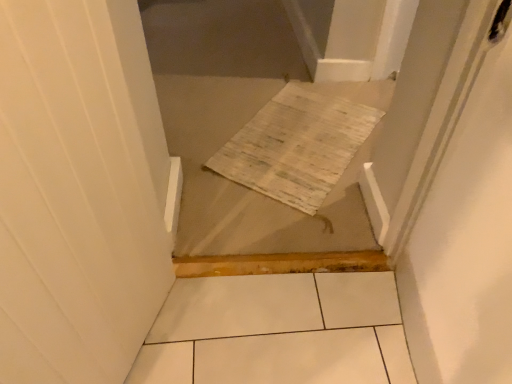
What do you see at coordinates (301, 141) in the screenshot? I see `woven fabric rug at center` at bounding box center [301, 141].

Find the location of a particular element. The image size is (512, 384). woven fabric rug at center is located at coordinates (301, 141).

The height and width of the screenshot is (384, 512). Identify the location of white glossy screen door at upper right. (448, 111).

What do you see at coordinates (448, 111) in the screenshot?
I see `white glossy screen door at upper right` at bounding box center [448, 111].

You are a GUI agent. You are given a task and a screenshot of the screen. Output one action in this format:
    pyautogui.click(x=<x>, y=<y>)
    Task: Click on the woven fabric rug at center
    
    Given the screenshot: What is the action you would take?
    pyautogui.click(x=301, y=141)

Is white glossy screen door at upper right to the left of woven fabric rug at center from the viewer's perspective?

In fact, white glossy screen door at upper right is to the right of woven fabric rug at center.

Is white glossy screen door at upper right behind woven fabric rug at center?

No, the depth of white glossy screen door at upper right is less than that of woven fabric rug at center.

Does point (389, 252) come closer to viewer compared to point (230, 175)?

Yes.

From the image's perspective, who appears lower, white glossy screen door at upper right or woven fabric rug at center?

From the image's view, woven fabric rug at center is below.

From a real-world perspective, is white glossy screen door at upper right on top of woven fabric rug at center?

Yes, from a real-world perspective, white glossy screen door at upper right is above woven fabric rug at center.

Which of these two, white glossy screen door at upper right or woven fabric rug at center, is wider?

Wider between the two is woven fabric rug at center.

Considering the relative sizes of white glossy screen door at upper right and woven fabric rug at center in the image provided, is white glossy screen door at upper right shorter than woven fabric rug at center?

Incorrect, the height of white glossy screen door at upper right does not fall short of that of woven fabric rug at center.

Can you confirm if white glossy screen door at upper right is bigger than woven fabric rug at center?

Indeed, white glossy screen door at upper right has a larger size compared to woven fabric rug at center.

Looking at this image, is white glossy screen door at upper right situated inside woven fabric rug at center or outside?

white glossy screen door at upper right exists outside the volume of woven fabric rug at center.

Is white glossy screen door at upper right positioned far away from woven fabric rug at center?

white glossy screen door at upper right is near woven fabric rug at center, not far away.

Is woven fabric rug at center at the back of white glossy screen door at upper right?

That's not correct — white glossy screen door at upper right is not looking away from woven fabric rug at center.

What's the angular difference between white glossy screen door at upper right and woven fabric rug at center's facing directions?

white glossy screen door at upper right and woven fabric rug at center are facing 38.6 degrees away from each other.

Measure the distance from white glossy screen door at upper right to woven fabric rug at center.

white glossy screen door at upper right and woven fabric rug at center are 31.52 inches apart from each other.

Image resolution: width=512 pixels, height=384 pixels. Find the location of `screen door above the woven fabric rug at center (from the image's perspective)`. screen door above the woven fabric rug at center (from the image's perspective) is located at coordinates (448, 111).

Based on their positions, is woven fabric rug at center located to the left or right of white glossy screen door at upper right?

woven fabric rug at center is positioned on white glossy screen door at upper right's left side.

In the scene shown: Is woven fabric rug at center positioned in front of white glossy screen door at upper right?

No, the depth of woven fabric rug at center is greater than that of white glossy screen door at upper right.

Does point (311, 108) come behind point (449, 74)?

Yes, it is.

From the image's perspective, is woven fabric rug at center located above or below white glossy screen door at upper right?

From the image's perspective, woven fabric rug at center appears below white glossy screen door at upper right.

From a real-world perspective, which object stands above the other?

In real-world perspective, white glossy screen door at upper right is above.

Can you confirm if woven fabric rug at center is wider than white glossy screen door at upper right?

Correct, the width of woven fabric rug at center exceeds that of white glossy screen door at upper right.

Can you confirm if woven fabric rug at center is shorter than white glossy screen door at upper right?

Yes, woven fabric rug at center is shorter than white glossy screen door at upper right.

Is woven fabric rug at center bigger than white glossy screen door at upper right?

Actually, woven fabric rug at center might be smaller than white glossy screen door at upper right.

Is woven fabric rug at center not inside white glossy screen door at upper right?

Yes.

Is woven fabric rug at center in contact with white glossy screen door at upper right?

No, woven fabric rug at center is not making contact with white glossy screen door at upper right.

Is woven fabric rug at center facing away from white glossy screen door at upper right?

No, woven fabric rug at center is not facing away from white glossy screen door at upper right.

How many degrees apart are the facing directions of woven fabric rug at center and white glossy screen door at upper right?

There is a 38.6-degree angle between the facing directions of woven fabric rug at center and white glossy screen door at upper right.

The width and height of the screenshot is (512, 384). What are the coordinates of `screen door on the right of woven fabric rug at center` in the screenshot? It's located at (448, 111).

The width and height of the screenshot is (512, 384). I want to click on cardboard on the left of white glossy screen door at upper right, so click(301, 141).

Where is `cardboard lying below the white glossy screen door at upper right (from the image's perspective)`? The width and height of the screenshot is (512, 384). cardboard lying below the white glossy screen door at upper right (from the image's perspective) is located at coordinates (301, 141).